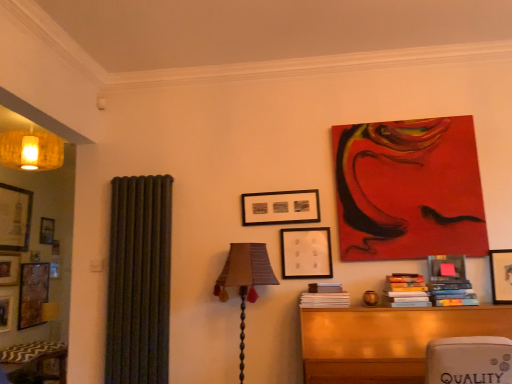
This screenshot has width=512, height=384. I want to click on hardcover books at center-right, the 2th book viewed from the left, so click(x=406, y=290).

I want to click on matte black picture frame at center, arranged as the second picture frame when viewed from the left, so pos(306,253).

Identify the location of wooden picture frame at upper right, the first picture frame in the right-to-left sequence. Image resolution: width=512 pixels, height=384 pixels. (501, 275).

What do you see at coordinates (452, 293) in the screenshot? This screenshot has width=512, height=384. I see `hardcover books at right, positioned as the third book in left-to-right order` at bounding box center [452, 293].

What do you see at coordinates (386, 340) in the screenshot?
I see `wooden table at lower right` at bounding box center [386, 340].

What do you see at coordinates (244, 281) in the screenshot? I see `textured fabric lampshade at center` at bounding box center [244, 281].

Identify the location of red acrylic painting at upper right. The image size is (512, 384). (x=408, y=189).

How distant is wooden picture frame at upper right, the third picture frame positioned from the left, from wooden book at lower right, the third book when ordered from right to left?

Result: 37.54 inches.

Which of these two, wooden picture frame at upper right, the third picture frame positioned from the left, or wooden book at lower right, the third book when ordered from right to left, is thinner?

Thinner between the two is wooden book at lower right, the third book when ordered from right to left.

Is wooden picture frame at upper right, the third picture frame in the back-to-front sequence, positioned beyond the bounds of wooden book at lower right, which ranks as the first book in left-to-right order?

Yes.

From the image's perspective, who appears lower, wooden picture frame at upper right, the third picture frame in the back-to-front sequence, or wooden book at lower right, which ranks as the first book in left-to-right order?

wooden book at lower right, which ranks as the first book in left-to-right order, is shown below in the image.

Is wooden picture frame at upper right, the 1th picture frame positioned from the front, looking in the opposite direction of textured fabric lampshade at center?

No.

Can we say wooden picture frame at upper right, the 1th picture frame positioned from the front, lies outside textured fabric lampshade at center?

Indeed, wooden picture frame at upper right, the 1th picture frame positioned from the front, is completely outside textured fabric lampshade at center.

Considering the relative positions of wooden picture frame at upper right, the third picture frame positioned from the left, and textured fabric lampshade at center in the image provided, is wooden picture frame at upper right, the third picture frame positioned from the left, to the left of textured fabric lampshade at center from the viewer's perspective?

In fact, wooden picture frame at upper right, the third picture frame positioned from the left, is to the right of textured fabric lampshade at center.

Is point (504, 291) closer to camera compared to point (240, 287)?

No, (504, 291) is further to viewer.

How distant is hardcover books at right, positioned as the third book in left-to-right order, from matte black picture frame at center, which is the 2th picture frame from back to front?

hardcover books at right, positioned as the third book in left-to-right order, is 30.01 inches away from matte black picture frame at center, which is the 2th picture frame from back to front.

Considering the relative sizes of hardcover books at right, positioned as the third book in left-to-right order, and matte black picture frame at center, arranged as the second picture frame when viewed from the left, in the image provided, is hardcover books at right, positioned as the third book in left-to-right order, thinner than matte black picture frame at center, arranged as the second picture frame when viewed from the left,?

In fact, hardcover books at right, positioned as the third book in left-to-right order, might be wider than matte black picture frame at center, arranged as the second picture frame when viewed from the left.

Is hardcover books at right, placed as the first book when sorted from right to left, with matte black picture frame at center, placed as the 2th picture frame when sorted from front to back?

No.

From a real-world perspective, is hardcover books at right, positioned as the third book in left-to-right order, on matte black picture frame at center, which is the 2th picture frame from back to front?

No.

How many degrees apart are the facing directions of black matte picture frame at center, arranged as the 3th picture frame when viewed from the front, and hardcover books at center-right, which appears as the 2th book when viewed from the right?

The facing directions of black matte picture frame at center, arranged as the 3th picture frame when viewed from the front, and hardcover books at center-right, which appears as the 2th book when viewed from the right, are 3.93 degrees apart.

Which is behind, point (308, 190) or point (411, 283)?

The point (308, 190) is behind.

Looking at this image, between black matte picture frame at center, arranged as the 3th picture frame when viewed from the front, and hardcover books at center-right, which appears as the 2th book when viewed from the right, which one has smaller width?

With smaller width is black matte picture frame at center, arranged as the 3th picture frame when viewed from the front.

Could you tell me if hardcover books at right, positioned as the third book in left-to-right order, is facing wooden picture frame at upper right, the third picture frame positioned from the left?

No, hardcover books at right, positioned as the third book in left-to-right order, is not oriented towards wooden picture frame at upper right, the third picture frame positioned from the left.

From the image's perspective, is hardcover books at right, positioned as the third book in left-to-right order, over wooden picture frame at upper right, the third picture frame positioned from the left?

No.

In the scene shown: Is hardcover books at right, positioned as the third book in left-to-right order, in front of or behind wooden picture frame at upper right, the third picture frame in the back-to-front sequence, in the image?

hardcover books at right, positioned as the third book in left-to-right order, is positioned farther from the viewer than wooden picture frame at upper right, the third picture frame in the back-to-front sequence.

Looking at this image, is hardcover books at right, placed as the first book when sorted from right to left, wider than wooden picture frame at upper right, the third picture frame in the back-to-front sequence?

In fact, hardcover books at right, placed as the first book when sorted from right to left, might be narrower than wooden picture frame at upper right, the third picture frame in the back-to-front sequence.

Who is smaller, matte black picture frame at center, which is the 2th picture frame from back to front, or wooden book at lower right, which ranks as the first book in left-to-right order?

With smaller size is matte black picture frame at center, which is the 2th picture frame from back to front.

How distant is matte black picture frame at center, arranged as the second picture frame when viewed from the left, from wooden book at lower right, which ranks as the first book in left-to-right order?

9.60 inches.

At what (x,y) coordinates should I click in order to perform the action: click on picture frame that is the 2nd one above the wooden book at lower right, the third book when ordered from right to left (from a real-world perspective). Please return your answer as a coordinate pair (x, y). Looking at the image, I should click on (306, 253).

Consider the image. Considering the relative positions of matte black picture frame at center, the second picture frame in the right-to-left sequence, and wooden book at lower right, the third book when ordered from right to left, in the image provided, is matte black picture frame at center, the second picture frame in the right-to-left sequence, to the right of wooden book at lower right, the third book when ordered from right to left, from the viewer's perspective?

In fact, matte black picture frame at center, the second picture frame in the right-to-left sequence, is to the left of wooden book at lower right, the third book when ordered from right to left.

Considering the relative positions of red acrylic painting at upper right and hardcover books at center-right, which appears as the 2th book when viewed from the right, in the image provided, is red acrylic painting at upper right to the right of hardcover books at center-right, which appears as the 2th book when viewed from the right, from the viewer's perspective?

Yes.

Does red acrylic painting at upper right lie behind hardcover books at center-right, the 2th book viewed from the left?

Yes, red acrylic painting at upper right is further from the camera.

Which of these two, red acrylic painting at upper right or hardcover books at center-right, the 2th book viewed from the left, is bigger?

Bigger between the two is red acrylic painting at upper right.

This screenshot has height=384, width=512. Find the location of `book that is the 3rd one when counting backward from the wooden picture frame at upper right, the first picture frame in the right-to-left sequence`. book that is the 3rd one when counting backward from the wooden picture frame at upper right, the first picture frame in the right-to-left sequence is located at coordinates (324, 296).

Locate an element on the screen. The height and width of the screenshot is (384, 512). table lamp below the wooden picture frame at upper right, the first picture frame in the right-to-left sequence (from the image's perspective) is located at coordinates (244, 281).

From the image, which object appears to be farther from wooden book at lower right, the third book when ordered from right to left, hardcover books at center-right, which appears as the 2th book when viewed from the right, or hardcover books at right, placed as the first book when sorted from right to left?

The object further to wooden book at lower right, the third book when ordered from right to left, is hardcover books at right, placed as the first book when sorted from right to left.

Looking at the image, which one is located closer to matte black picture frame at center, the second picture frame in the right-to-left sequence, textured fabric lampshade at center or wooden picture frame at upper right, the 1th picture frame positioned from the front?

textured fabric lampshade at center is closer to matte black picture frame at center, the second picture frame in the right-to-left sequence.

Considering their positions, is hardcover books at center-right, which appears as the 2th book when viewed from the right, positioned further to wooden table at lower right than wooden book at lower right, which ranks as the first book in left-to-right order?

wooden book at lower right, which ranks as the first book in left-to-right order.

Based on their spatial positions, is wooden picture frame at upper right, the third picture frame positioned from the left, or wooden book at lower right, which ranks as the first book in left-to-right order, further from red acrylic painting at upper right?

wooden book at lower right, which ranks as the first book in left-to-right order, is further to red acrylic painting at upper right.

Looking at this image, considering their positions, is wooden table at lower right positioned closer to hardcover books at center-right, the 2th book viewed from the left, than black matte picture frame at center, acting as the 1th picture frame starting from the back?

wooden table at lower right is closer to hardcover books at center-right, the 2th book viewed from the left.

Based on their spatial positions, is wooden book at lower right, the third book when ordered from right to left, or textured fabric lampshade at center closer to hardcover books at right, positioned as the third book in left-to-right order?

The object closer to hardcover books at right, positioned as the third book in left-to-right order, is wooden book at lower right, the third book when ordered from right to left.

Based on their spatial positions, is matte black picture frame at center, placed as the 2th picture frame when sorted from front to back, or wooden picture frame at upper right, the first picture frame in the right-to-left sequence, further from wooden book at lower right, the third book when ordered from right to left?

wooden picture frame at upper right, the first picture frame in the right-to-left sequence, is positioned further to the anchor wooden book at lower right, the third book when ordered from right to left.

Which object lies nearer to the anchor point black matte picture frame at center, the third picture frame in the right-to-left sequence, hardcover books at right, placed as the first book when sorted from right to left, or wooden book at lower right, the third book when ordered from right to left?

The object closer to black matte picture frame at center, the third picture frame in the right-to-left sequence, is wooden book at lower right, the third book when ordered from right to left.

The width and height of the screenshot is (512, 384). I want to click on book between wooden table at lower right and wooden picture frame at upper right, the 1th picture frame positioned from the front, so click(452, 293).

In order to click on art between black matte picture frame at center, marked as the first picture frame in a left-to-right arrangement, and wooden picture frame at upper right, the third picture frame in the back-to-front sequence in this screenshot , I will do `click(408, 189)`.

You are a GUI agent. You are given a task and a screenshot of the screen. Output one action in this format:
    pyautogui.click(x=<x>, y=<y>)
    Task: Click on the art situated between textured fabric lampshade at center and wooden picture frame at upper right, the first picture frame in the right-to-left sequence, from left to right
    The height and width of the screenshot is (384, 512).
    Given the screenshot: What is the action you would take?
    pyautogui.click(x=408, y=189)

Identify the location of table between textured fabric lampshade at center and wooden picture frame at upper right, the third picture frame in the back-to-front sequence. The width and height of the screenshot is (512, 384). (386, 340).